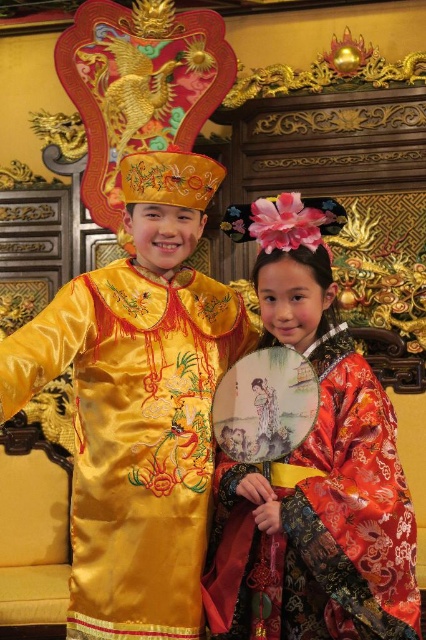
Can you confirm if satin yellow robe at center is taller than silky red dress at center?

Yes.

Is satin yellow robe at center shorter than silky red dress at center?

Incorrect, satin yellow robe at center's height does not fall short of silky red dress at center's.

Who is more forward, (x=123, y=376) or (x=209, y=596)?

Positioned in front is point (x=209, y=596).

You are a GUI agent. You are given a task and a screenshot of the screen. Output one action in this format:
    pyautogui.click(x=<x>, y=<y>)
    Task: Click on the satin yellow robe at center
    The image size is (426, 640).
    Given the screenshot: What is the action you would take?
    pyautogui.click(x=138, y=404)